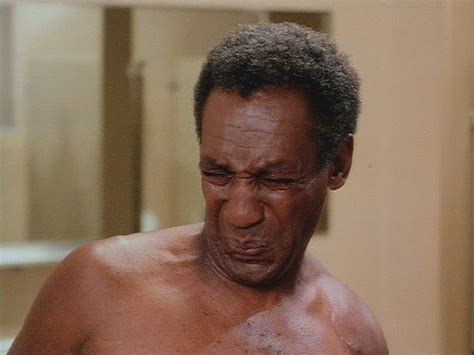
Find the location of `back wall`. back wall is located at coordinates (38, 163).